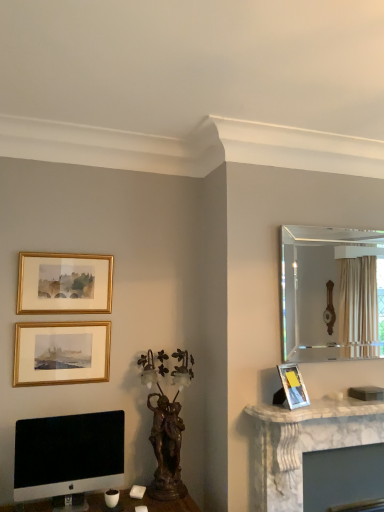
Question: Is the position of white marble fireplace at right more distant than that of clear glass mirror at upper right?

Choices:
 (A) yes
 (B) no

Answer: (B)

Question: Considering the relative sizes of white marble fireplace at right and clear glass mirror at upper right in the image provided, is white marble fireplace at right taller than clear glass mirror at upper right?

Choices:
 (A) no
 (B) yes

Answer: (A)

Question: From the image's perspective, is white marble fireplace at right on top of clear glass mirror at upper right?

Choices:
 (A) yes
 (B) no

Answer: (B)

Question: From a real-world perspective, is white marble fireplace at right beneath clear glass mirror at upper right?

Choices:
 (A) no
 (B) yes

Answer: (B)

Question: Is white marble fireplace at right aimed at clear glass mirror at upper right?

Choices:
 (A) yes
 (B) no

Answer: (B)

Question: Looking at their shapes, would you say white marble fireplace at right is wider or thinner than gold framed picture at upper left, the 3th picture frame from the bottom?

Choices:
 (A) thin
 (B) wide

Answer: (B)

Question: Would you say white marble fireplace at right is inside or outside gold framed picture at upper left, the 3th picture frame from the bottom?

Choices:
 (A) outside
 (B) inside

Answer: (A)

Question: From a real-world perspective, is white marble fireplace at right above or below gold framed picture at upper left, the 2th picture frame from the left?

Choices:
 (A) below
 (B) above

Answer: (A)

Question: In terms of size, does white marble fireplace at right appear bigger or smaller than gold framed picture at upper left, the 1th picture frame positioned from the top?

Choices:
 (A) big
 (B) small

Answer: (A)

Question: Would you say sleek silver monitor at lower left is to the left or to the right of clear glass mirror at upper right in the picture?

Choices:
 (A) right
 (B) left

Answer: (B)

Question: Considering the positions of sleek silver monitor at lower left and clear glass mirror at upper right in the image, is sleek silver monitor at lower left wider or thinner than clear glass mirror at upper right?

Choices:
 (A) wide
 (B) thin

Answer: (A)

Question: Is point (x=102, y=425) closer or farther from the camera than point (x=306, y=281)?

Choices:
 (A) closer
 (B) farther

Answer: (A)

Question: From the image's perspective, is sleek silver monitor at lower left located above or below clear glass mirror at upper right?

Choices:
 (A) above
 (B) below

Answer: (B)

Question: From a real-world perspective, is white marble fireplace at right above or below white marble fireplace at right?

Choices:
 (A) above
 (B) below

Answer: (B)

Question: Considering their positions, is white marble fireplace at right located in front of or behind white marble fireplace at right?

Choices:
 (A) front
 (B) behind

Answer: (B)